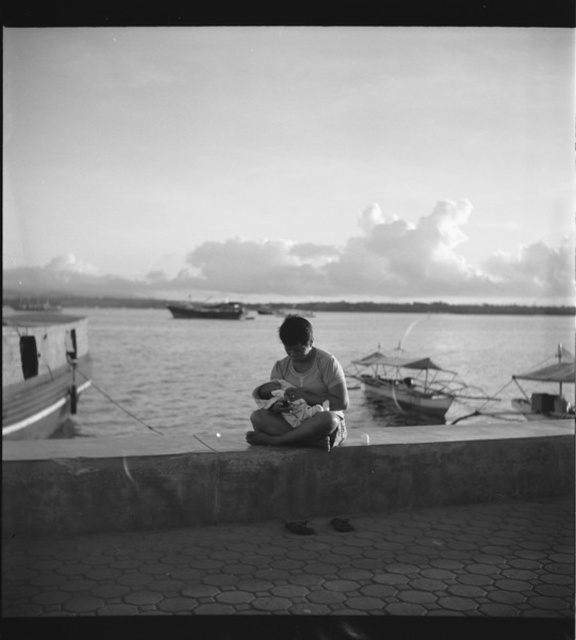
Who is shorter, smooth skin woman at center or wooden boat at center?

smooth skin woman at center is shorter.

Does point (252, 416) come in front of point (445, 388)?

Yes, it is in front of point (445, 388).

The height and width of the screenshot is (640, 576). Identify the location of smooth skin woman at center. (301, 394).

The height and width of the screenshot is (640, 576). Find the location of `wooden boat at left`. wooden boat at left is located at coordinates (41, 371).

This screenshot has width=576, height=640. What do you see at coordinates (41, 371) in the screenshot? I see `wooden boat at left` at bounding box center [41, 371].

The width and height of the screenshot is (576, 640). I want to click on wooden boat at left, so click(41, 371).

Is smooth skin woman at center to the left of smooth wooden boat at right from the viewer's perspective?

Yes, smooth skin woman at center is to the left of smooth wooden boat at right.

What do you see at coordinates (301, 394) in the screenshot? I see `smooth skin woman at center` at bounding box center [301, 394].

The width and height of the screenshot is (576, 640). What are the coordinates of `smooth skin woman at center` in the screenshot? It's located at (301, 394).